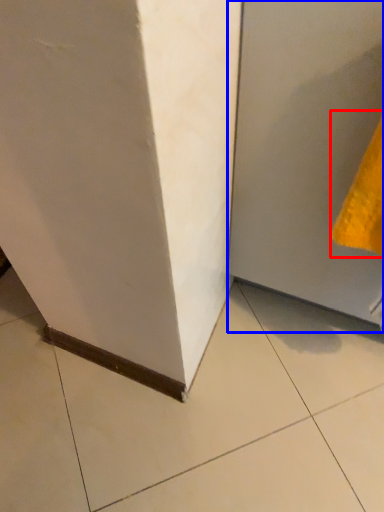
Question: Among these objects, which one is nearest to the camera, hand towel (highlighted by a red box) or door (highlighted by a blue box)?

Choices:
 (A) hand towel
 (B) door

Answer: (B)